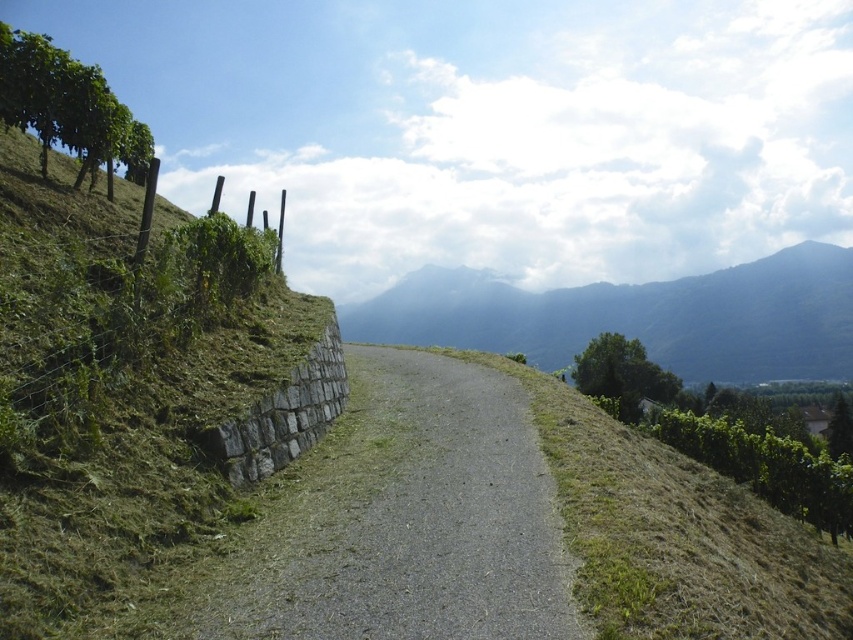
You are a hiker standing at the starting point of your journey. You see the gray gravel path at center. If you follow the path straight ahead, will it lead you towards the distant mountain range visible in the background?

Yes, the gray gravel path at center leads towards the distant mountain range as it winds through the scene in that direction.